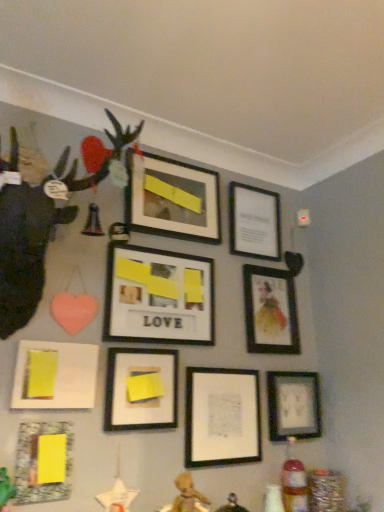
Question: Does matte glass picture frame at lower left, which ranks as the 9th picture frame in right-to-left order, have a greater width compared to matte black figurine at left?

Choices:
 (A) no
 (B) yes

Answer: (A)

Question: Can you confirm if matte glass picture frame at lower left, the first picture frame when ordered from left to right, is shorter than matte black figurine at left?

Choices:
 (A) no
 (B) yes

Answer: (B)

Question: Is matte glass picture frame at lower left, which ranks as the 9th picture frame in right-to-left order, placed right next to matte black figurine at left?

Choices:
 (A) no
 (B) yes

Answer: (A)

Question: Is matte glass picture frame at lower left, the first picture frame when ordered from left to right, further to the viewer compared to matte black figurine at left?

Choices:
 (A) yes
 (B) no

Answer: (A)

Question: From a real-world perspective, does matte glass picture frame at lower left, the first picture frame when ordered from left to right, stand above matte black figurine at left?

Choices:
 (A) yes
 (B) no

Answer: (B)

Question: Considering the positions of matte glass picture frame at lower left, which ranks as the 9th picture frame in right-to-left order, and matte black picture frame at center, which is counted as the 7th picture frame, starting from the right, in the image, is matte glass picture frame at lower left, which ranks as the 9th picture frame in right-to-left order, bigger or smaller than matte black picture frame at center, which is counted as the 7th picture frame, starting from the right,?

Choices:
 (A) small
 (B) big

Answer: (A)

Question: From the image's perspective, is matte glass picture frame at lower left, which ranks as the 9th picture frame in right-to-left order, positioned above or below matte black picture frame at center, which is counted as the 7th picture frame, starting from the right?

Choices:
 (A) above
 (B) below

Answer: (B)

Question: Based on their positions, is matte glass picture frame at lower left, the first picture frame when ordered from left to right, located to the left or right of matte black picture frame at center, which is counted as the 7th picture frame, starting from the right?

Choices:
 (A) left
 (B) right

Answer: (A)

Question: Relative to matte black picture frame at center, which is counted as the 7th picture frame, starting from the right, is matte glass picture frame at lower left, the first picture frame when ordered from left to right, in front or behind?

Choices:
 (A) front
 (B) behind

Answer: (A)

Question: Is point (18, 461) positioned closer to the camera than point (94, 364)?

Choices:
 (A) closer
 (B) farther

Answer: (A)

Question: From their relative heights in the image, would you say matte glass picture frame at lower left, the first picture frame when ordered from left to right, is taller or shorter than white matte picture frame at lower left, the 8th picture frame when ordered from right to left?

Choices:
 (A) tall
 (B) short

Answer: (A)

Question: Is matte glass picture frame at lower left, which ranks as the 9th picture frame in right-to-left order, in front of or behind white matte picture frame at lower left, the 8th picture frame when ordered from right to left, in the image?

Choices:
 (A) behind
 (B) front

Answer: (B)

Question: In the image, is matte glass picture frame at lower left, the first picture frame when ordered from left to right, on the left side or the right side of white matte picture frame at lower left, the 8th picture frame when ordered from right to left?

Choices:
 (A) left
 (B) right

Answer: (A)

Question: In the image, is matte black picture frame at upper right, placed as the 2th picture frame when sorted from right to left, on the left side or the right side of matte glass picture frame at lower left, the first picture frame when ordered from left to right?

Choices:
 (A) right
 (B) left

Answer: (A)

Question: Is point (243, 269) closer or farther from the camera than point (54, 470)?

Choices:
 (A) closer
 (B) farther

Answer: (B)